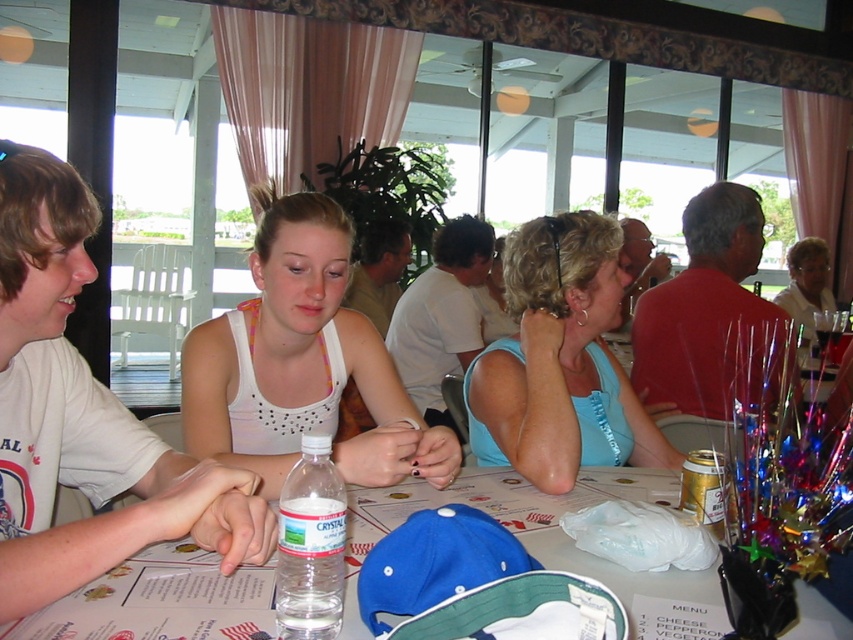
Between point (251, 436) and point (567, 257), which one is positioned behind?

Point (567, 257)

At what (x,y) coordinates should I click in order to perform the action: click on white matte tank top at center. Please return your answer as a coordinate pair (x, y). The width and height of the screenshot is (853, 640). Looking at the image, I should click on (302, 364).

Can you confirm if white matte tank top at center is positioned to the left of clear plastic water bottle at center?

Indeed, white matte tank top at center is positioned on the left side of clear plastic water bottle at center.

The image size is (853, 640). What do you see at coordinates (302, 364) in the screenshot?
I see `white matte tank top at center` at bounding box center [302, 364].

Locate an element on the screen. white matte tank top at center is located at coordinates (302, 364).

In the scene shown: Does light blue fabric tank top at center appear under clear plastic water bottle at center?

No.

Which of these two, light blue fabric tank top at center or clear plastic water bottle at center, stands taller?

Standing taller between the two is light blue fabric tank top at center.

Between point (612, 429) and point (323, 500), which one is positioned in front?

Point (323, 500) is more forward.

The image size is (853, 640). What are the coordinates of `light blue fabric tank top at center` in the screenshot? It's located at (560, 362).